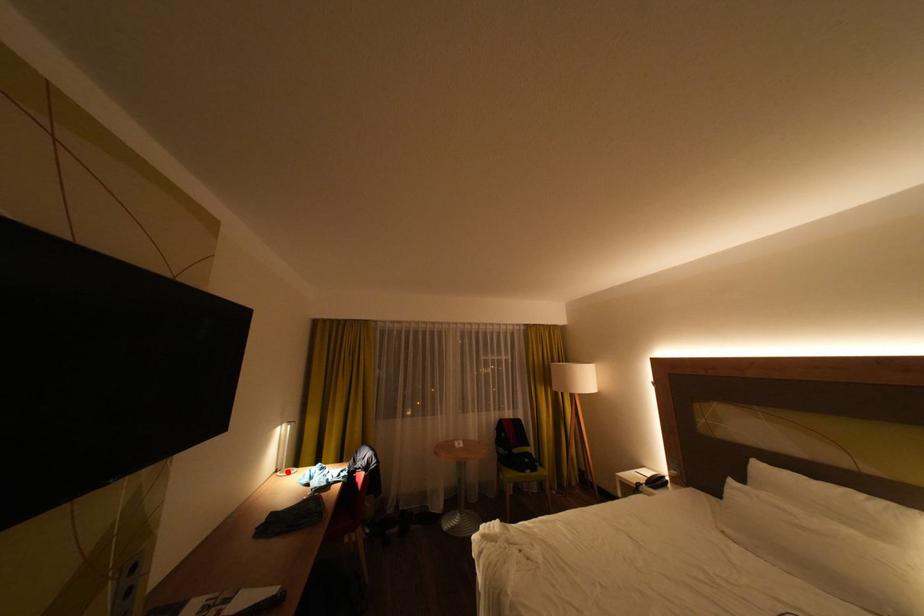
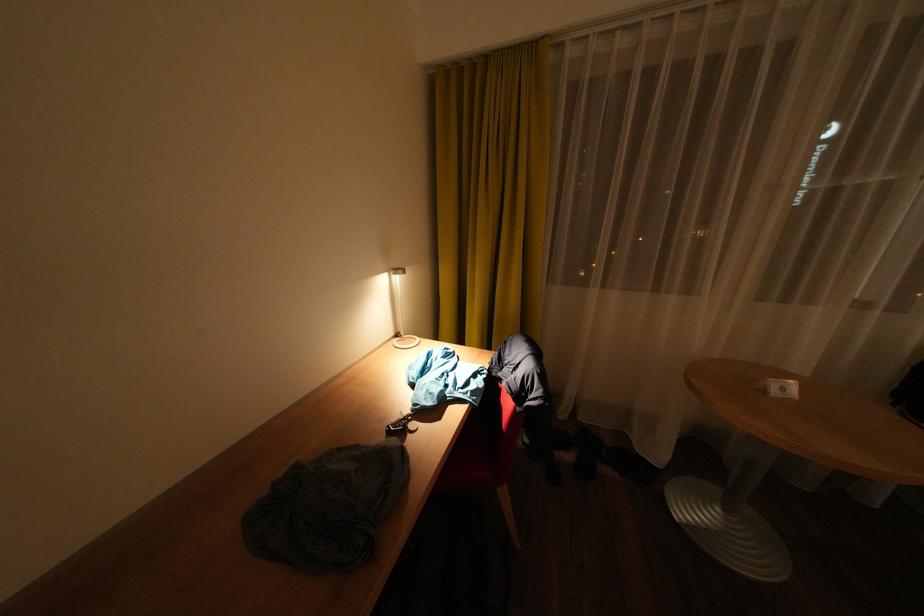
Where in the second image is the point corresponding to the highlighted location from the first image?

(407, 336)